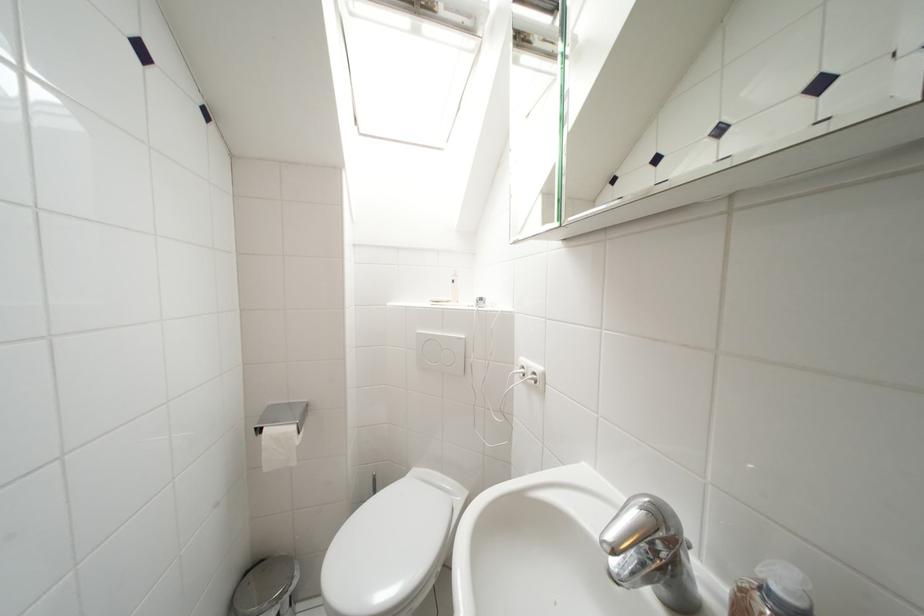
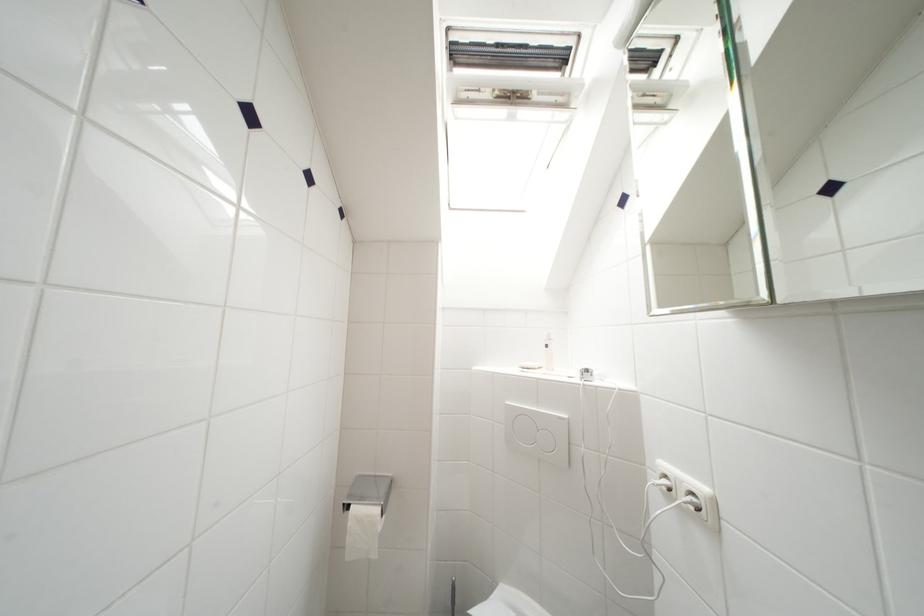
What movement of the cameraman would produce the second image?

The cameraman moved toward left, forward.